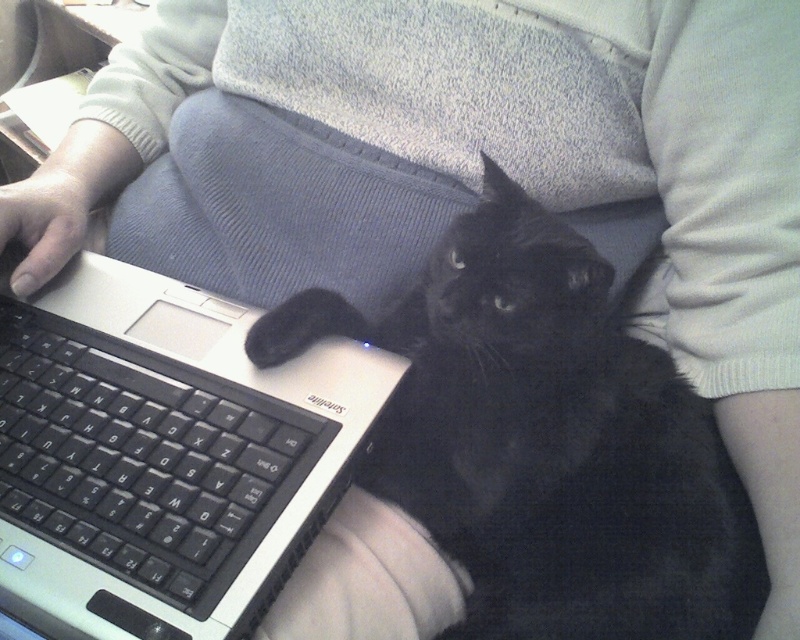
You are a photographer trying to capture a clear shot of the black matte laptop at left without the black fur cat at center blocking it. Based on their heights, is it possible to position the camera lower to the ground to frame the laptop while the cat is still on it?

The black fur cat at center is taller than the black matte laptop at left. Lowering the camera might not help because the cat is taller and could still block the laptop.

You are a delivery robot that needs to deliver a package to the person using the laptop. The robot has a width of 4 inches. Can you fit between the black fur cat at center and the black matte laptop at left to reach the person?

The distance between the black fur cat at center and the black matte laptop at left is 4.20 inches, so yes, the robot can fit through the space since its width of 4 inches is less than the available space.

You are a delivery robot trying to navigate around the black fur cat at center and the black matte laptop at left. Since you need to avoid both, which object requires you to make a wider detour?

The black fur cat at center requires a wider detour because it is bigger than the black matte laptop at left.